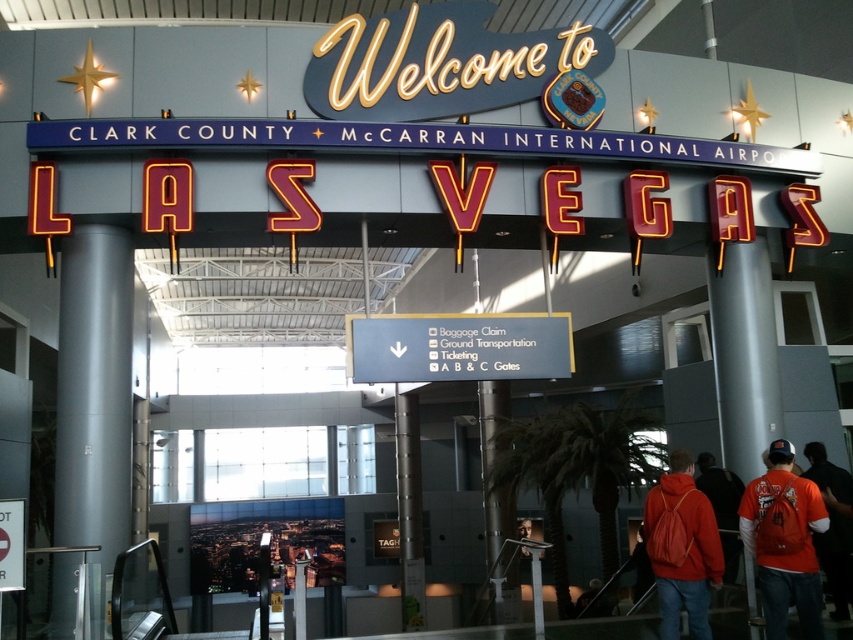
Question: Which object is farther from the camera taking this photo?

Choices:
 (A) orange fabric shirt at lower right
 (B) metallic gray pillar at center
 (C) black plastic sign at center
 (D) matte orange backpack at lower right

Answer: (B)

Question: Can you confirm if silver metallic pillar at right is positioned above orange fabric backpack at lower right?

Choices:
 (A) no
 (B) yes

Answer: (B)

Question: Does metallic gray column at left appear over orange fabric shirt at lower right?

Choices:
 (A) no
 (B) yes

Answer: (B)

Question: Which object is closer to the camera taking this photo?

Choices:
 (A) black plastic sign at center
 (B) orange fabric shirt at lower right
 (C) metallic gray pillar at center

Answer: (B)

Question: Which is farther from the black plastic sign at center?

Choices:
 (A) metallic gray pillar at center
 (B) metallic gray column at left
 (C) orange fabric backpack at lower right

Answer: (A)

Question: Can you confirm if orange fabric backpack at lower right is positioned above matte orange backpack at lower right?

Choices:
 (A) yes
 (B) no

Answer: (A)